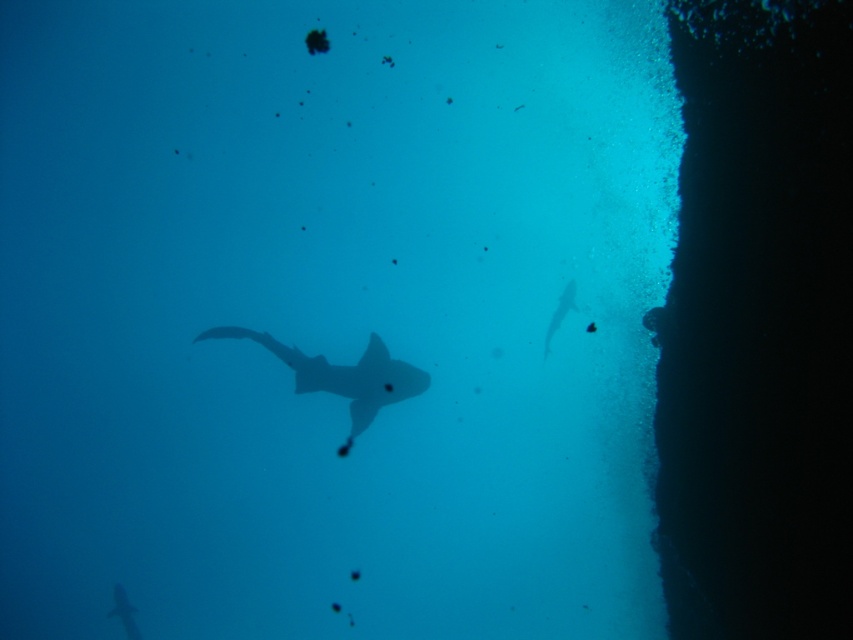
Question: Which point is closer to the camera taking this photo?

Choices:
 (A) (369, 371)
 (B) (553, 317)

Answer: (A)

Question: Which object appears farthest from the camera in this image?

Choices:
 (A) translucent gray fish at right
 (B) translucent gray shark at center

Answer: (A)

Question: Does translucent gray shark at center appear on the right side of translucent gray fish at right?

Choices:
 (A) yes
 (B) no

Answer: (B)

Question: Can you confirm if translucent gray shark at center is wider than translucent gray fish at right?

Choices:
 (A) yes
 (B) no

Answer: (A)

Question: Observing the image, what is the correct spatial positioning of translucent gray shark at center in reference to translucent gray fish at right?

Choices:
 (A) right
 (B) left

Answer: (B)